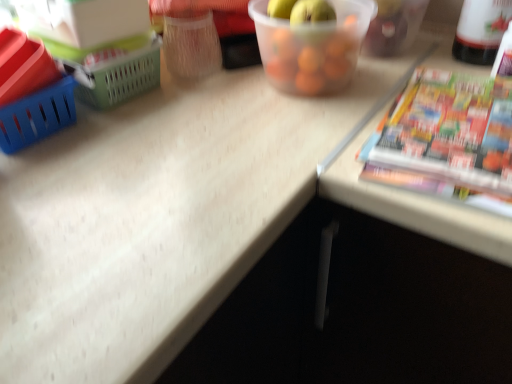
You are a GUI agent. You are given a task and a screenshot of the screen. Output one action in this format:
    pyautogui.click(x=<x>, y=<y>)
    Task: Click on the translucent plastic container at upper center
    The image size is (512, 384).
    Given the screenshot: What is the action you would take?
    pyautogui.click(x=312, y=47)

Describe the element at coordinates (312, 47) in the screenshot. The image size is (512, 384). I see `translucent plastic container at upper center` at that location.

The width and height of the screenshot is (512, 384). Describe the element at coordinates (481, 30) in the screenshot. I see `white plastic bottle at upper right` at that location.

Where is `multicolored glossy paperback book at right`? This screenshot has width=512, height=384. multicolored glossy paperback book at right is located at coordinates (447, 139).

Between translucent plastic container at upper center and white plastic bottle at upper right, which one appears on the right side from the viewer's perspective?

From the viewer's perspective, white plastic bottle at upper right appears more on the right side.

Measure the distance between translucent plastic container at upper center and white plastic bottle at upper right.

translucent plastic container at upper center and white plastic bottle at upper right are 9.82 inches apart.

Is translucent plastic container at upper center turned away from white plastic bottle at upper right?

translucent plastic container at upper center does not have its back to white plastic bottle at upper right.

Which of these two, translucent plastic container at upper center or white plastic bottle at upper right, is thinner?

Thinner between the two is white plastic bottle at upper right.

How different are the orientations of multicolored glossy paperback book at right and white plastic bottle at upper right in degrees?

0.00167 degrees.

Considering the positions of point (455, 132) and point (494, 16), is point (455, 132) closer or farther from the camera than point (494, 16)?

Point (455, 132).

Is multicolored glossy paperback book at right next to white plastic bottle at upper right and touching it?

multicolored glossy paperback book at right and white plastic bottle at upper right are clearly separated.

Find the location of a particular element. This screenshot has height=384, width=512. paperback book on the left of white plastic bottle at upper right is located at coordinates [447, 139].

Is white plastic bottle at upper right positioned beyond the bounds of translucent plastic container at upper center?

Yes, white plastic bottle at upper right is outside of translucent plastic container at upper center.

From a real-world perspective, is white plastic bottle at upper right positioned over translucent plastic container at upper center based on gravity?

Correct, in the physical world, white plastic bottle at upper right is higher than translucent plastic container at upper center.

From the image's perspective, is white plastic bottle at upper right above or below translucent plastic container at upper center?

white plastic bottle at upper right is situated higher than translucent plastic container at upper center in the image.

Is white plastic bottle at upper right not close to translucent plastic container at upper center?

No, white plastic bottle at upper right is not far away from translucent plastic container at upper center.

Looking at this image, who is smaller, translucent plastic container at upper center or multicolored glossy paperback book at right?

multicolored glossy paperback book at right is smaller.

Based on the photo, considering the positions of objects translucent plastic container at upper center and multicolored glossy paperback book at right in the image provided, who is more to the left, translucent plastic container at upper center or multicolored glossy paperback book at right?

From the viewer's perspective, translucent plastic container at upper center appears more on the left side.

Is multicolored glossy paperback book at right at the back of translucent plastic container at upper center?

No, multicolored glossy paperback book at right is not at the back of translucent plastic container at upper center.

From the image's perspective, between multicolored glossy paperback book at right and translucent plastic container at upper center, which one is located above?

translucent plastic container at upper center, from the image's perspective.

How different are the orientations of multicolored glossy paperback book at right and translucent plastic container at upper center in degrees?

The angle between the facing direction of multicolored glossy paperback book at right and the facing direction of translucent plastic container at upper center is 88.2 degrees.

Find the location of a particular element. This screenshot has height=384, width=512. paperback book located underneath the translucent plastic container at upper center (from a real-world perspective) is located at coordinates (447, 139).

How much distance is there between multicolored glossy paperback book at right and translucent plastic container at upper center?

They are 18.30 centimeters apart.

How many degrees apart are the facing directions of white plastic bottle at upper right and multicolored glossy paperback book at right?

The facing directions of white plastic bottle at upper right and multicolored glossy paperback book at right are 0.00167 degrees apart.

In the scene shown: Between white plastic bottle at upper right and multicolored glossy paperback book at right, which one is positioned in front?

multicolored glossy paperback book at right is closer to the camera.

Is white plastic bottle at upper right not close to multicolored glossy paperback book at right?

That's not correct — white plastic bottle at upper right is a little close to multicolored glossy paperback book at right.

In the scene shown: From the image's perspective, is white plastic bottle at upper right located beneath multicolored glossy paperback book at right?

No, from the image's perspective, white plastic bottle at upper right is not beneath multicolored glossy paperback book at right.

This screenshot has height=384, width=512. I want to click on bottle behind the translucent plastic container at upper center, so click(x=481, y=30).

In the image, there is a multicolored glossy paperback book at right. Identify the location of bottle above it (from the image's perspective). This screenshot has height=384, width=512. (481, 30).

Considering their positions, is translucent plastic container at upper center positioned further to white plastic bottle at upper right than multicolored glossy paperback book at right?

Among the two, translucent plastic container at upper center is located further to white plastic bottle at upper right.

Considering their positions, is white plastic bottle at upper right positioned closer to translucent plastic container at upper center than multicolored glossy paperback book at right?

Among the two, multicolored glossy paperback book at right is located nearer to translucent plastic container at upper center.

From the image, which object appears to be nearer to translucent plastic container at upper center, multicolored glossy paperback book at right or white plastic bottle at upper right?

Among the two, multicolored glossy paperback book at right is located nearer to translucent plastic container at upper center.

Estimate the real-world distances between objects in this image. Which object is further from multicolored glossy paperback book at right, translucent plastic container at upper center or white plastic bottle at upper right?

The object further to multicolored glossy paperback book at right is white plastic bottle at upper right.

Looking at the image, which one is located closer to multicolored glossy paperback book at right, white plastic bottle at upper right or translucent plastic container at upper center?

Among the two, translucent plastic container at upper center is located nearer to multicolored glossy paperback book at right.

Considering their positions, is multicolored glossy paperback book at right positioned closer to white plastic bottle at upper right than translucent plastic container at upper center?

The object closer to white plastic bottle at upper right is multicolored glossy paperback book at right.

Where is `paperback book between translucent plastic container at upper center and white plastic bottle at upper right in the horizontal direction`? paperback book between translucent plastic container at upper center and white plastic bottle at upper right in the horizontal direction is located at coordinates (447, 139).